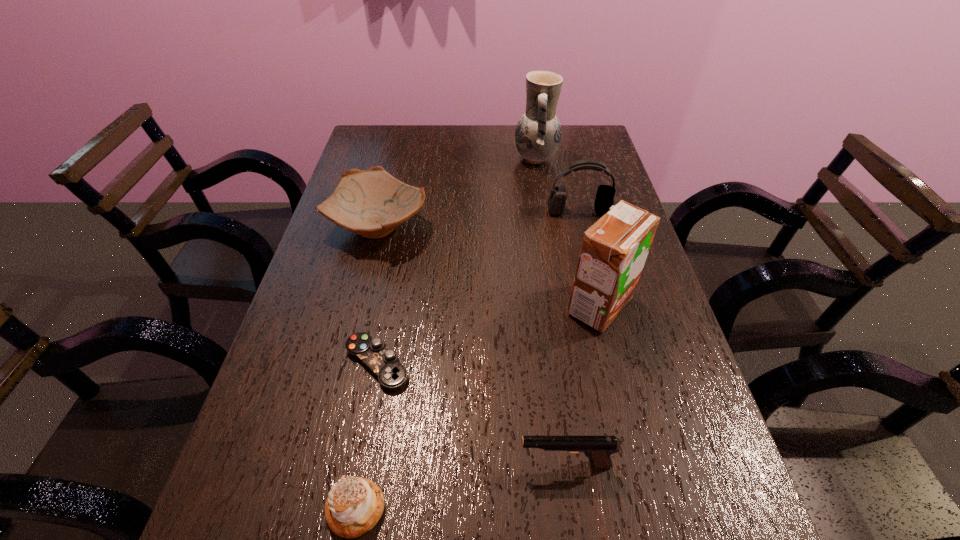
At what (x,y) coordinates should I click in order to perform the action: click on vacant area situated 0.160m on the front of the third nearest object. Please return your answer as a coordinate pair (x, y). This screenshot has width=960, height=540. Looking at the image, I should click on (355, 479).

This screenshot has height=540, width=960. Identify the location of object situated at the far edge. tap(538, 132).

This screenshot has height=540, width=960. Find the location of `pottery present at the left edge`. pottery present at the left edge is located at coordinates (372, 203).

The width and height of the screenshot is (960, 540). I want to click on control that is at the left edge, so pyautogui.click(x=384, y=363).

Locate an element on the screen. pottery positioned at the right edge is located at coordinates (538, 132).

I want to click on carton at the right edge, so click(614, 250).

Identify the location of headset present at the right edge. This screenshot has width=960, height=540. (556, 202).

Image resolution: width=960 pixels, height=540 pixels. Identify the location of object positioned at the far right corner. (538, 132).

In the image, there is a desktop. Where is `free region at the far edge`? free region at the far edge is located at coordinates (465, 144).

This screenshot has width=960, height=540. In the image, there is a desktop. What are the coordinates of `vacant space at the left edge` in the screenshot? It's located at (367, 254).